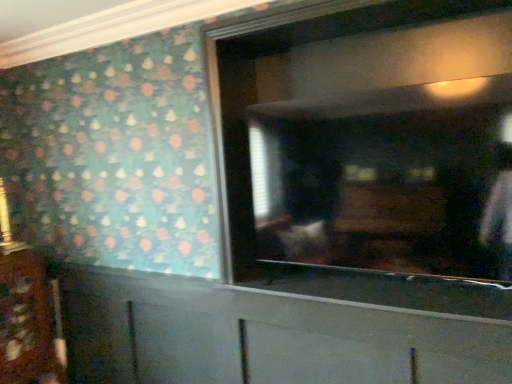
Question: From a real-world perspective, is white matte cabinet at lower center, which is counted as the 1th cabinetry, starting from the right, physically above matte glass mirror at center?

Choices:
 (A) no
 (B) yes

Answer: (A)

Question: Is the depth of white matte cabinet at lower center, which is counted as the 1th cabinetry, starting from the right, less than that of matte glass mirror at center?

Choices:
 (A) no
 (B) yes

Answer: (A)

Question: Is white matte cabinet at lower center, the second cabinetry when ordered from left to right, behind matte glass mirror at center?

Choices:
 (A) yes
 (B) no

Answer: (A)

Question: Are white matte cabinet at lower center, the second cabinetry when ordered from left to right, and matte glass mirror at center making contact?

Choices:
 (A) no
 (B) yes

Answer: (A)

Question: Can you confirm if white matte cabinet at lower center, which is counted as the 1th cabinetry, starting from the right, is smaller than matte glass mirror at center?

Choices:
 (A) yes
 (B) no

Answer: (B)

Question: Is matte glass mirror at center situated inside wooden cabinet at lower left, which is counted as the 1th cabinetry, starting from the left, or outside?

Choices:
 (A) inside
 (B) outside

Answer: (B)

Question: Considering the positions of point (385, 137) and point (37, 302), is point (385, 137) closer or farther from the camera than point (37, 302)?

Choices:
 (A) farther
 (B) closer

Answer: (B)

Question: Looking at the image, does matte glass mirror at center seem bigger or smaller compared to wooden cabinet at lower left, which is counted as the 1th cabinetry, starting from the left?

Choices:
 (A) big
 (B) small

Answer: (A)

Question: From the image's perspective, is matte glass mirror at center positioned above or below wooden cabinet at lower left, marked as the second cabinetry in a right-to-left arrangement?

Choices:
 (A) below
 (B) above

Answer: (B)

Question: Is point click(x=264, y=322) positioned closer to the camera than point click(x=474, y=114)?

Choices:
 (A) closer
 (B) farther

Answer: (B)

Question: Looking at their shapes, would you say white matte cabinet at lower center, which is counted as the 1th cabinetry, starting from the right, is wider or thinner than matte glass mirror at center?

Choices:
 (A) thin
 (B) wide

Answer: (A)

Question: Considering the positions of white matte cabinet at lower center, which is counted as the 1th cabinetry, starting from the right, and matte glass mirror at center in the image, is white matte cabinet at lower center, which is counted as the 1th cabinetry, starting from the right, taller or shorter than matte glass mirror at center?

Choices:
 (A) tall
 (B) short

Answer: (A)

Question: From a real-world perspective, is white matte cabinet at lower center, the second cabinetry when ordered from left to right, positioned above or below matte glass mirror at center?

Choices:
 (A) above
 (B) below

Answer: (B)

Question: In the image, is matte glass mirror at center on the left side or the right side of white matte cabinet at lower center, the second cabinetry when ordered from left to right?

Choices:
 (A) right
 (B) left

Answer: (A)

Question: Considering the positions of matte glass mirror at center and white matte cabinet at lower center, the second cabinetry when ordered from left to right, in the image, is matte glass mirror at center bigger or smaller than white matte cabinet at lower center, the second cabinetry when ordered from left to right,?

Choices:
 (A) small
 (B) big

Answer: (A)